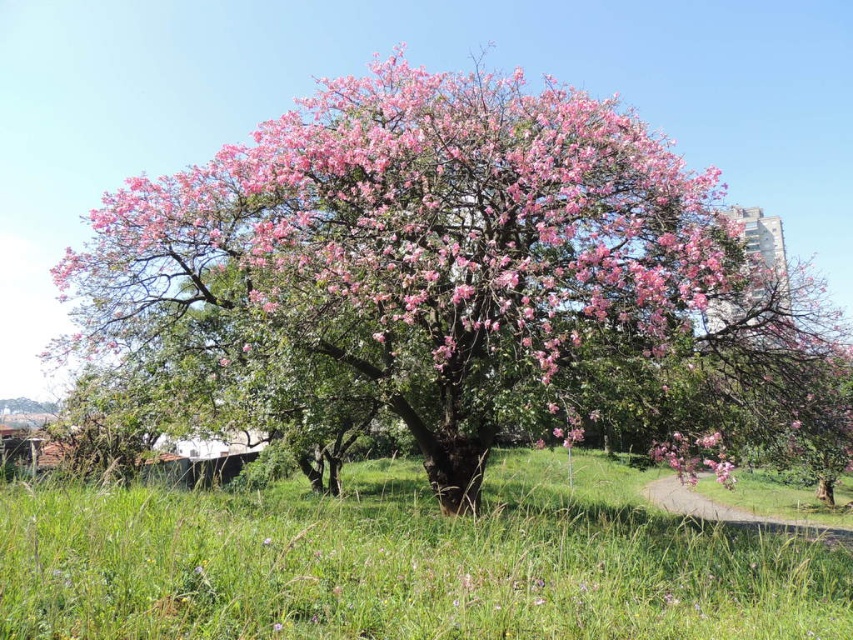
You are a gardener planning to plant a new tree in a garden that has limited space. The garden currently has green grass at center. If you plant the pink blossoming tree at center, will it fit without overcrowding the area?

The pink blossoming tree at center is bigger than the green grass at center, so planting it in the garden might lead to overcrowding due to its larger size compared to the existing grass.

You are planning to plant a new tree in your garden. The space you have is exactly the same width as the green grass at center in the image. Will the pink blossoming tree at center fit in that space?

The pink blossoming tree at center is wider than the green grass at center, so it will not fit in the space with the same width as the green grass at center.

You are standing in the grassy field with the pink blossoming tree at center in front of you. There is a point marked at coordinates (462, 282). Can you tell me what is located at that point?

The point at coordinates (462, 282) indicates the location of the pink blossoming tree at center.